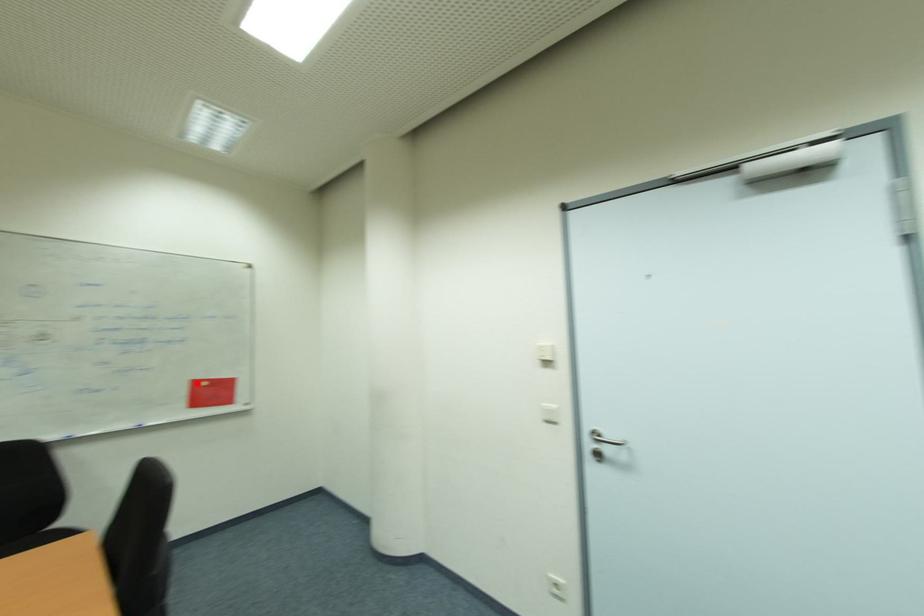
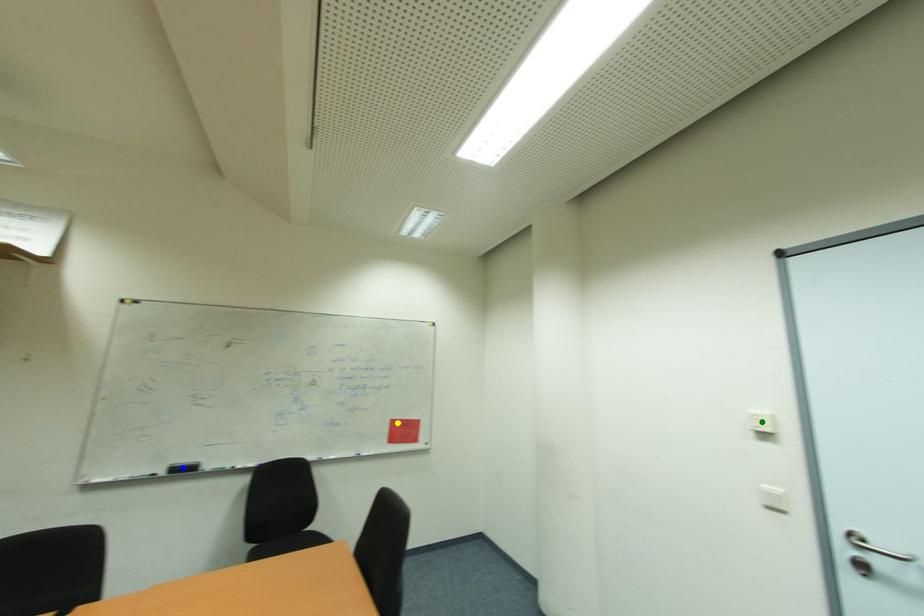
Question: I am providing you with two images of the same scene from different viewpoints. A red point is marked on the first image. You are given multiple points on the second image. Can you choose the point in image 2 that corresponds to the point in image 1?

Choices:
 (A) blue point
 (B) green point
 (C) yellow point

Answer: (C)